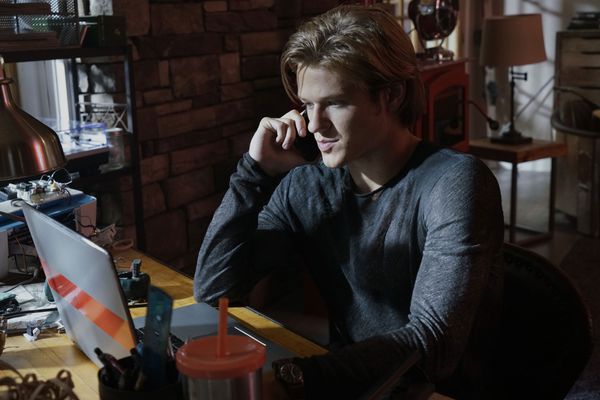
Identify the location of lamp shade. (515, 37).